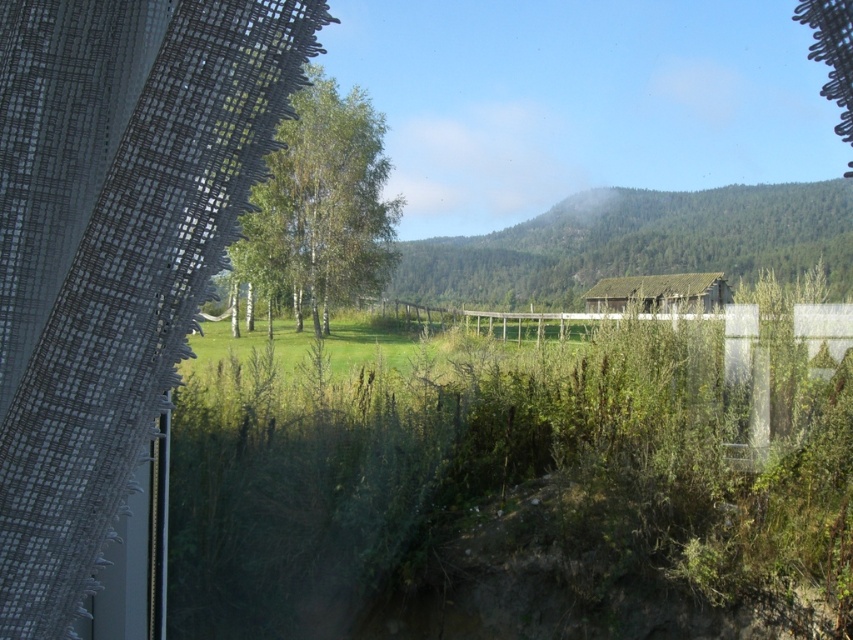
Question: Among these points, which one is farthest from the camera?

Choices:
 (A) (270, 269)
 (B) (703, 285)
 (C) (817, 188)

Answer: (A)

Question: Which point is closer to the camera?

Choices:
 (A) [x=614, y=228]
 (B) [x=692, y=280]
 (C) [x=358, y=266]

Answer: (B)

Question: Is green forested mountain at center bigger than rustic wooden hut at center?

Choices:
 (A) no
 (B) yes

Answer: (A)

Question: Among these points, which one is nearest to the camera?

Choices:
 (A) (709, 220)
 (B) (651, 280)

Answer: (B)

Question: Can you confirm if green leafy tree at center is wider than rustic wooden hut at center?

Choices:
 (A) no
 (B) yes

Answer: (B)

Question: Where is green leafy tree at center located in relation to rustic wooden hut at center in the image?

Choices:
 (A) left
 (B) right

Answer: (A)